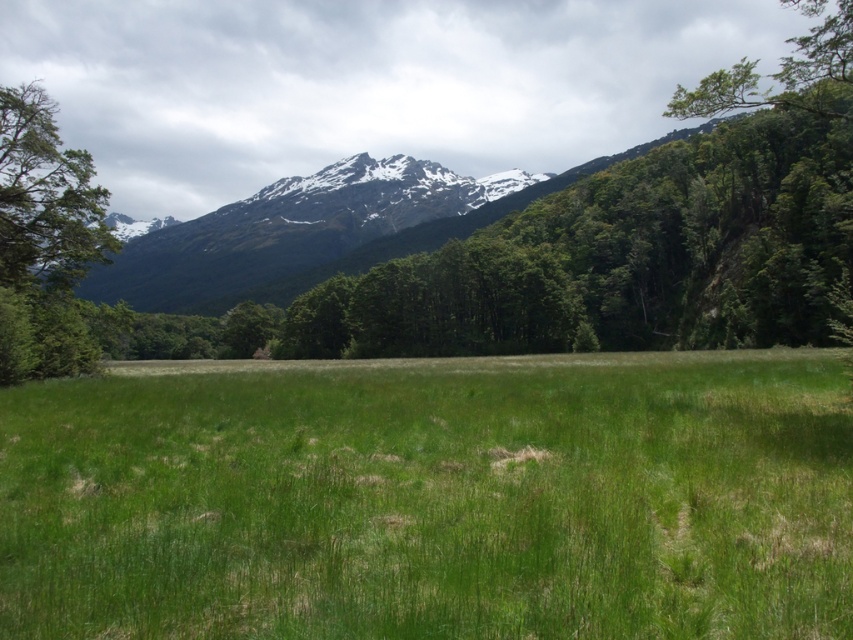
You are standing in the middle of the green grassy pasture at center and want to walk towards the green leafy tree at left. Which direction should you face to move closer to the tree?

Since the green grassy pasture at center is closer to the viewer than the green leafy tree at left, you should face towards the left direction to move closer to the green leafy tree at left.